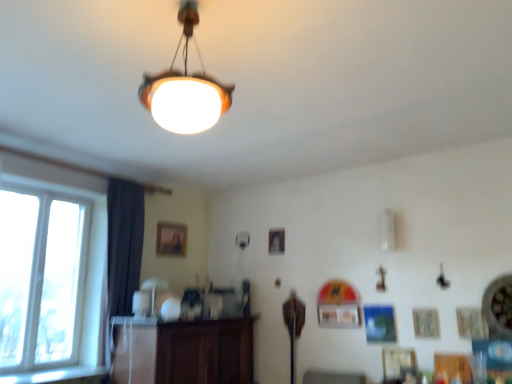
Question: From the image's perspective, is white glass window at left on top of dark fabric curtain at left?

Choices:
 (A) yes
 (B) no

Answer: (A)

Question: Is white glass window at left not within dark fabric curtain at left?

Choices:
 (A) yes
 (B) no

Answer: (A)

Question: Is white glass window at left to the right of dark fabric curtain at left from the viewer's perspective?

Choices:
 (A) no
 (B) yes

Answer: (A)

Question: Are white glass window at left and dark fabric curtain at left located far from each other?

Choices:
 (A) no
 (B) yes

Answer: (A)

Question: Is white glass window at left further to camera compared to dark fabric curtain at left?

Choices:
 (A) no
 (B) yes

Answer: (A)

Question: Is dark fabric curtain at left located within white glass window at left?

Choices:
 (A) no
 (B) yes

Answer: (A)

Question: Is brown wooden dresser at center positioned in front of dark fabric curtain at left?

Choices:
 (A) no
 (B) yes

Answer: (B)

Question: Does brown wooden dresser at center turn towards dark fabric curtain at left?

Choices:
 (A) yes
 (B) no

Answer: (B)

Question: Is brown wooden dresser at center oriented away from dark fabric curtain at left?

Choices:
 (A) yes
 (B) no

Answer: (B)

Question: Is brown wooden dresser at center at the right side of dark fabric curtain at left?

Choices:
 (A) yes
 (B) no

Answer: (A)

Question: Can you confirm if brown wooden dresser at center is smaller than dark fabric curtain at left?

Choices:
 (A) yes
 (B) no

Answer: (B)

Question: Considering the relative sizes of brown wooden dresser at center and dark fabric curtain at left in the image provided, is brown wooden dresser at center thinner than dark fabric curtain at left?

Choices:
 (A) yes
 (B) no

Answer: (B)

Question: Is brown wooden dresser at center to the right of matte white lampshade at center, the first lamp viewed from the back, from the viewer's perspective?

Choices:
 (A) yes
 (B) no

Answer: (A)